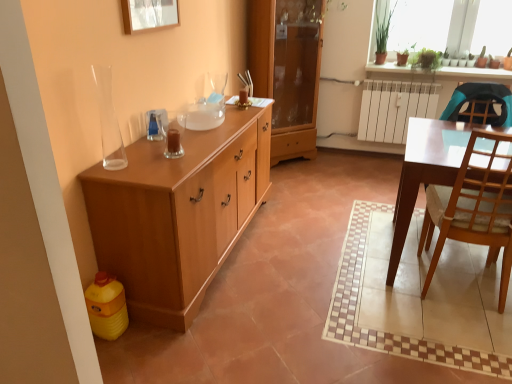
Question: Would you say green leafy plant at upper right, which appears as the 2th houseplant when viewed from the right, is to the left or to the right of light brown wood cabinet at left, which is the first cabinetry in front-to-back order, in the picture?

Choices:
 (A) left
 (B) right

Answer: (B)

Question: Is point (375, 3) closer or farther from the camera than point (220, 259)?

Choices:
 (A) closer
 (B) farther

Answer: (B)

Question: Based on their relative distances, which object is farther from the green matte plant at upper right, positioned as the second houseplant in left-to-right order?

Choices:
 (A) light brown wooden chair at right
 (B) wooden cabinet at center, positioned as the 1th cabinetry in back-to-front order
 (C) light brown wood cabinet at left, which is the first cabinetry in front-to-back order
 (D) transparent glass vase at upper left
 (E) green leafy plant at upper right, which appears as the 2th houseplant when viewed from the right

Answer: (D)

Question: Which is nearer to the green matte plant at upper right, the 1th houseplant from the right?

Choices:
 (A) green leafy plant at upper right, which appears as the 2th houseplant when viewed from the right
 (B) light brown wooden chair at right
 (C) transparent glass vase at upper left
 (D) green glass vase at upper right
 (E) transparent glass sink at center

Answer: (D)